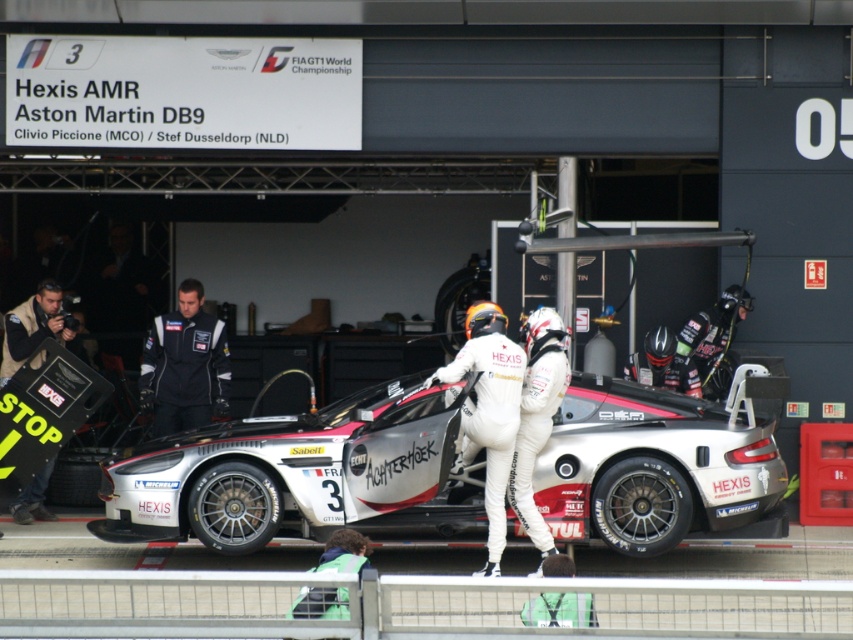
Who is more distant from viewer, (405, 488) or (170, 326)?

The point (170, 326) is behind.

Who is more forward, (294, 472) or (225, 356)?

Point (294, 472)

You are a GUI agent. You are given a task and a screenshot of the screen. Output one action in this format:
    pyautogui.click(x=<x>, y=<y>)
    Task: Click on the silver metallic race car at center
    The width and height of the screenshot is (853, 640).
    Given the screenshot: What is the action you would take?
    pyautogui.click(x=299, y=474)

Who is more distant from viewer, (442, 442) or (45, 509)?

Positioned behind is point (45, 509).

Is point (572, 529) closer to viewer compared to point (27, 317)?

Yes, point (572, 529) is in front of point (27, 317).

Identify the location of silver metallic race car at center. The width and height of the screenshot is (853, 640). (299, 474).

Who is positioned more to the left, black fabric suit at center or khaki jacket at left?

khaki jacket at left

Who is more forward, (x=219, y=365) or (x=22, y=499)?

Positioned in front is point (x=22, y=499).

This screenshot has height=640, width=853. What are the coordinates of `black fabric suit at center` in the screenshot? It's located at (184, 365).